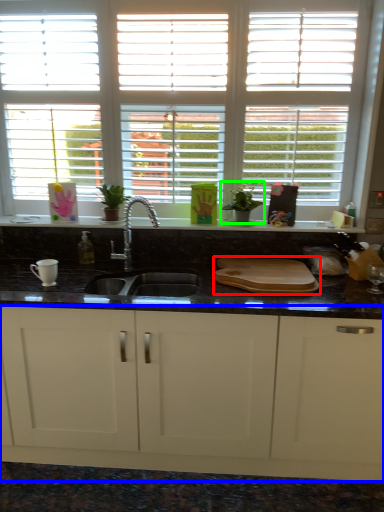
Question: Considering the real-world distances, which object is farthest from tray (highlighted by a red box)? cabinetry (highlighted by a blue box) or plant (highlighted by a green box)?

Choices:
 (A) cabinetry
 (B) plant

Answer: (A)